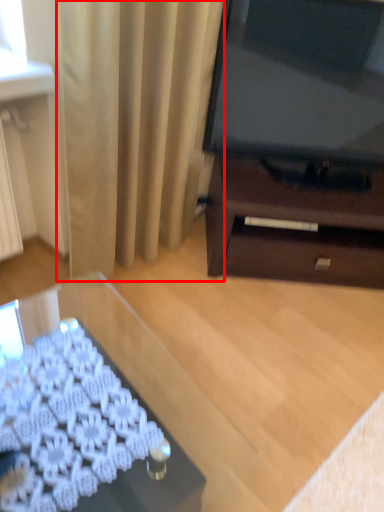
Question: From the image's perspective, considering the relative positions of curtain (annotated by the red box) and desk in the image provided, where is curtain (annotated by the red box) located with respect to the staircase?

Choices:
 (A) above
 (B) below

Answer: (A)